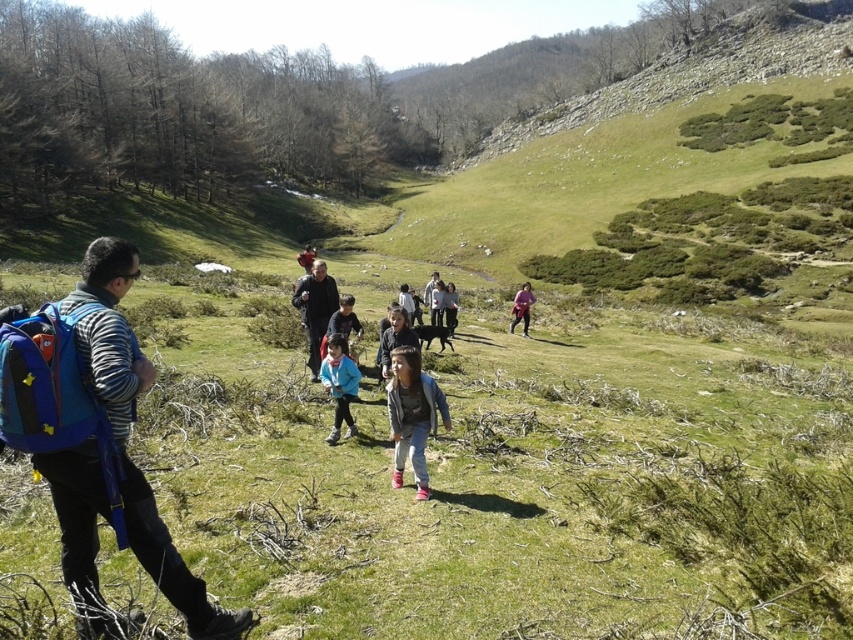
You are a photographer trying to capture a photo of the group hiking in the valley. You notice two jackets at the center of the image. Which jacket is closer to the camera, the denim jacket at center or the black fabric jacket at center?

The denim jacket at center is positioned under the black fabric jacket at center, so the black fabric jacket at center is closer to the camera.

You are a hiker who just arrived at the valley and want to put your jacket on a flat surface near the center. Is there a suitable place to place the denim jacket at center?

Yes, the denim jacket at center is located at point (x=412, y=416), so you can place it there.

You are a photographer trying to capture both the denim jacket at center and the blue fleece jacket at center in a single shot. Which jacket will appear larger in the photo?

The denim jacket at center will appear larger in the photo because it is closer to the viewer than the blue fleece jacket at center.